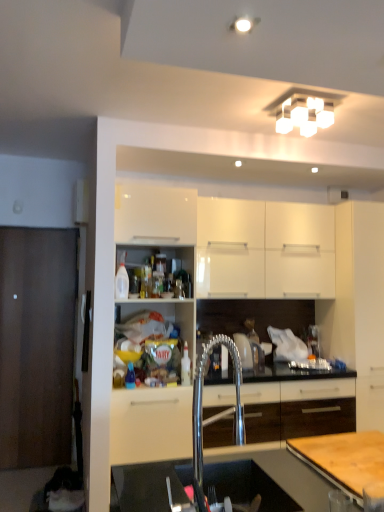
Describe the element at coordinates (345, 458) in the screenshot. The height and width of the screenshot is (512, 384). I see `wooden cutting board at lower right` at that location.

This screenshot has height=512, width=384. Describe the element at coordinates (130, 377) in the screenshot. I see `translucent plastic bottle at shelf center, marked as the second bottle in a back-to-front arrangement` at that location.

Describe the element at coordinates (264, 249) in the screenshot. The height and width of the screenshot is (512, 384). I see `white glossy cabinet at upper center, the 1th cabinetry positioned from the left` at that location.

How much space does translucent plastic bottle at center, the 1th bottle positioned from the right, occupy horizontally?

4.56 inches.

What do you see at coordinates (304, 114) in the screenshot?
I see `white square light fixture at upper center` at bounding box center [304, 114].

Find the location of a particular element. wooden cutting board at lower right is located at coordinates (345, 458).

Where is `table on the right of white glossy cabinet at upper center, arranged as the 2th cabinetry when viewed from the right`? The width and height of the screenshot is (384, 512). table on the right of white glossy cabinet at upper center, arranged as the 2th cabinetry when viewed from the right is located at coordinates (345, 458).

From a real-world perspective, is wooden cutting board at lower right positioned under white glossy cabinet at upper center, arranged as the 2th cabinetry when viewed from the right, based on gravity?

Indeed, from a real-world perspective, wooden cutting board at lower right is positioned beneath white glossy cabinet at upper center, arranged as the 2th cabinetry when viewed from the right.

Is wooden cutting board at lower right not close to white glossy cabinet at upper center, the 1th cabinetry positioned from the left?

Indeed, wooden cutting board at lower right is not near white glossy cabinet at upper center, the 1th cabinetry positioned from the left.

Is wooden cutting board at lower right smaller than white glossy cabinet at upper center, arranged as the 2th cabinetry when viewed from the right?

Correct, wooden cutting board at lower right occupies less space than white glossy cabinet at upper center, arranged as the 2th cabinetry when viewed from the right.

Considering the relative sizes of white square light fixture at upper center and wooden cutting board at lower right in the image provided, is white square light fixture at upper center shorter than wooden cutting board at lower right?

No, white square light fixture at upper center is not shorter than wooden cutting board at lower right.

Could you measure the distance between white square light fixture at upper center and wooden cutting board at lower right?

white square light fixture at upper center and wooden cutting board at lower right are 6.16 feet apart.

Which of these two, white square light fixture at upper center or wooden cutting board at lower right, is wider?

Wider between the two is wooden cutting board at lower right.

Considering the sizes of objects white square light fixture at upper center and wooden cutting board at lower right in the image provided, who is smaller, white square light fixture at upper center or wooden cutting board at lower right?

Smaller between the two is wooden cutting board at lower right.

Which is behind, white matte cabinet at right, marked as the 1th cabinetry in a right-to-left arrangement, or wooden cutting board at lower right?

white matte cabinet at right, marked as the 1th cabinetry in a right-to-left arrangement, is further from the camera.

Is wooden cutting board at lower right at the back of white matte cabinet at right, which ranks as the 2th cabinetry in left-to-right order?

white matte cabinet at right, which ranks as the 2th cabinetry in left-to-right order, is not turned away from wooden cutting board at lower right.

Is white matte cabinet at right, which ranks as the 2th cabinetry in left-to-right order, next to wooden cutting board at lower right and touching it?

white matte cabinet at right, which ranks as the 2th cabinetry in left-to-right order, and wooden cutting board at lower right are clearly separated.

Is wooden cutting board at lower right completely or partially inside white matte cabinet at right, marked as the 1th cabinetry in a right-to-left arrangement?

No, white matte cabinet at right, marked as the 1th cabinetry in a right-to-left arrangement, does not contain wooden cutting board at lower right.

Relative to translucent plastic bottle at shelf center, marked as the second bottle in a back-to-front arrangement, is polished stainless steel sink at center in front or behind?

Clearly, polished stainless steel sink at center is in front of translucent plastic bottle at shelf center, marked as the second bottle in a back-to-front arrangement.

Which is in front, point (196, 407) or point (128, 364)?

The point (196, 407) is closer to the camera.

Is polished stainless steel sink at center situated inside translucent plastic bottle at shelf center, marked as the 1th bottle in a left-to-right arrangement, or outside?

polished stainless steel sink at center is outside translucent plastic bottle at shelf center, marked as the 1th bottle in a left-to-right arrangement.

Between point (345, 328) and point (182, 362), which one is positioned behind?

Positioned behind is point (345, 328).

Can you confirm if white matte cabinet at right, which ranks as the 2th cabinetry in left-to-right order, is thinner than translucent plastic bottle at center, the second bottle when ordered from front to back?

In fact, white matte cabinet at right, which ranks as the 2th cabinetry in left-to-right order, might be wider than translucent plastic bottle at center, the second bottle when ordered from front to back.

From the picture: Considering the sizes of objects white matte cabinet at right, marked as the 1th cabinetry in a right-to-left arrangement, and translucent plastic bottle at center, the 1th bottle positioned from the right, in the image provided, who is bigger, white matte cabinet at right, marked as the 1th cabinetry in a right-to-left arrangement, or translucent plastic bottle at center, the 1th bottle positioned from the right,?

With larger size is white matte cabinet at right, marked as the 1th cabinetry in a right-to-left arrangement.

Between white matte cabinet at right, which ranks as the 2th cabinetry in left-to-right order, and translucent plastic bottle at center, marked as the first bottle in a back-to-front arrangement, which one has less height?

Standing shorter between the two is translucent plastic bottle at center, marked as the first bottle in a back-to-front arrangement.

Is wooden cutting board at lower right wider or thinner than translucent plastic bottle at shelf center, the second bottle in the right-to-left sequence?

Considering their sizes, wooden cutting board at lower right looks broader than translucent plastic bottle at shelf center, the second bottle in the right-to-left sequence.

Can translucent plastic bottle at shelf center, marked as the 1th bottle in a left-to-right arrangement, be found inside wooden cutting board at lower right?

No, translucent plastic bottle at shelf center, marked as the 1th bottle in a left-to-right arrangement, is not a part of wooden cutting board at lower right.

Is there a large distance between wooden cutting board at lower right and translucent plastic bottle at shelf center, positioned as the first bottle in front-to-back order?

Yes, wooden cutting board at lower right and translucent plastic bottle at shelf center, positioned as the first bottle in front-to-back order, are located far from each other.

From a real-world perspective, is wooden cutting board at lower right above or below translucent plastic bottle at shelf center, marked as the second bottle in a back-to-front arrangement?

In terms of real-world spatial position, wooden cutting board at lower right is below translucent plastic bottle at shelf center, marked as the second bottle in a back-to-front arrangement.

Which is in front, white glossy cabinet at upper center, the 1th cabinetry positioned from the left, or white square light fixture at upper center?

white square light fixture at upper center is more forward.

Who is bigger, white glossy cabinet at upper center, arranged as the 2th cabinetry when viewed from the right, or white square light fixture at upper center?

Bigger between the two is white glossy cabinet at upper center, arranged as the 2th cabinetry when viewed from the right.

Looking at this image, between white glossy cabinet at upper center, the 1th cabinetry positioned from the left, and white square light fixture at upper center, which one has more height?

Standing taller between the two is white glossy cabinet at upper center, the 1th cabinetry positioned from the left.

From a real-world perspective, starting from the wooden cutting board at lower right, which cabinetry is the 2nd one vertically above it? Please provide its 2D coordinates.

[(264, 249)]

Find the location of a particular element. light fixture that appears on the left of wooden cutting board at lower right is located at coordinates (304, 114).

Estimate the real-world distances between objects in this image. Which object is closer to white matte cabinet at right, marked as the 1th cabinetry in a right-to-left arrangement, wooden cutting board at lower right or white glossy cabinet at upper center, arranged as the 2th cabinetry when viewed from the right?

Among the two, white glossy cabinet at upper center, arranged as the 2th cabinetry when viewed from the right, is located nearer to white matte cabinet at right, marked as the 1th cabinetry in a right-to-left arrangement.

When comparing their distances from white matte cabinet at right, which ranks as the 2th cabinetry in left-to-right order, does white square light fixture at upper center or translucent plastic bottle at center, the 1th bottle positioned from the right, seem closer?

white square light fixture at upper center is positioned closer to the anchor white matte cabinet at right, which ranks as the 2th cabinetry in left-to-right order.

Which object lies nearer to the anchor point white square light fixture at upper center, wooden cutting board at lower right or white matte cabinet at right, marked as the 1th cabinetry in a right-to-left arrangement?

white matte cabinet at right, marked as the 1th cabinetry in a right-to-left arrangement, is positioned closer to the anchor white square light fixture at upper center.

Considering their positions, is translucent plastic bottle at center, the second bottle when ordered from front to back, positioned closer to polished stainless steel sink at center than white glossy cabinet at upper center, the 1th cabinetry positioned from the left?

translucent plastic bottle at center, the second bottle when ordered from front to back.

Looking at this image, considering their positions, is wooden cutting board at lower right positioned closer to translucent plastic bottle at shelf center, the second bottle in the right-to-left sequence, than white square light fixture at upper center?

Among the two, wooden cutting board at lower right is located nearer to translucent plastic bottle at shelf center, the second bottle in the right-to-left sequence.

When comparing their distances from translucent plastic bottle at center, the second bottle when ordered from front to back, does white square light fixture at upper center or translucent plastic bottle at shelf center, marked as the second bottle in a back-to-front arrangement, seem further?

The object further to translucent plastic bottle at center, the second bottle when ordered from front to back, is white square light fixture at upper center.

Consider the image. Looking at the image, which one is located closer to white square light fixture at upper center, polished stainless steel sink at center or wooden cutting board at lower right?

Among the two, polished stainless steel sink at center is located nearer to white square light fixture at upper center.

Considering their positions, is wooden cutting board at lower right positioned closer to translucent plastic bottle at center, the second bottle when ordered from front to back, than white matte cabinet at right, marked as the 1th cabinetry in a right-to-left arrangement?

white matte cabinet at right, marked as the 1th cabinetry in a right-to-left arrangement, is positioned closer to the anchor translucent plastic bottle at center, the second bottle when ordered from front to back.

Locate an element on the screen. The width and height of the screenshot is (384, 512). cabinetry between wooden cutting board at lower right and white matte cabinet at right, marked as the 1th cabinetry in a right-to-left arrangement, in the front-back direction is located at coordinates point(264,249).

This screenshot has height=512, width=384. Find the location of `table between white square light fixture at upper center and translucent plastic bottle at shelf center, the second bottle in the right-to-left sequence, in the vertical direction`. table between white square light fixture at upper center and translucent plastic bottle at shelf center, the second bottle in the right-to-left sequence, in the vertical direction is located at coordinates (345, 458).

Where is `cabinetry between translucent plastic bottle at center, the second bottle when ordered from front to back, and white matte cabinet at right, marked as the 1th cabinetry in a right-to-left arrangement, in the horizontal direction`? cabinetry between translucent plastic bottle at center, the second bottle when ordered from front to back, and white matte cabinet at right, marked as the 1th cabinetry in a right-to-left arrangement, in the horizontal direction is located at coordinates (264, 249).

This screenshot has height=512, width=384. In order to click on table between polished stainless steel sink at center and white glossy cabinet at upper center, arranged as the 2th cabinetry when viewed from the right, from front to back in this screenshot , I will do `click(345, 458)`.